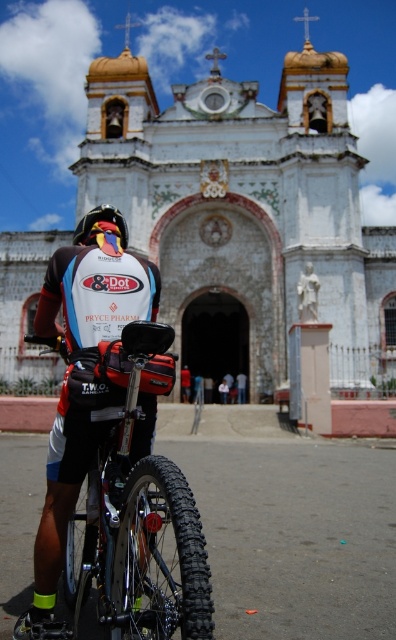
You are a photographer standing in front of the white stone church at center and the red fabric shorts at center. You want to capture a wide shot that includes both objects. Which object should you position closer to the edges of the frame to ensure both fit in the shot?

To ensure both the white stone church at center and the red fabric shorts at center fit in the shot, position the red fabric shorts at center closer to the edges of the frame since the white stone church at center might be wider than the red fabric shorts at center.